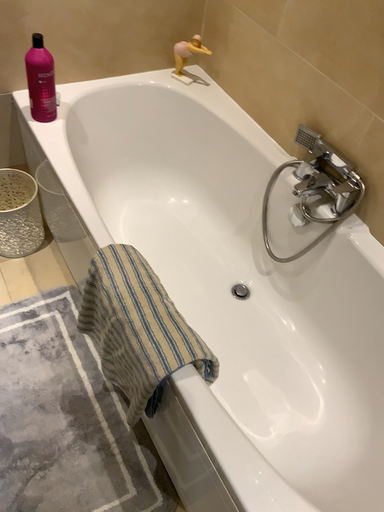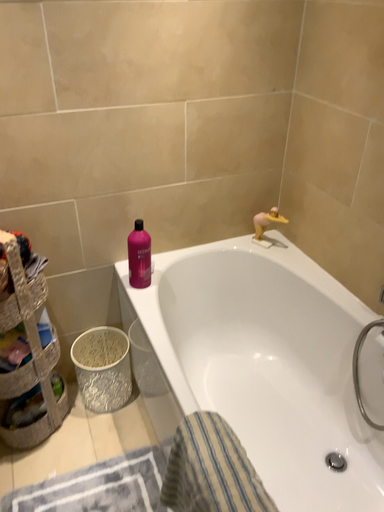
Question: Which way did the camera rotate in the video?

Choices:
 (A) rotated downward
 (B) rotated upward

Answer: (B)